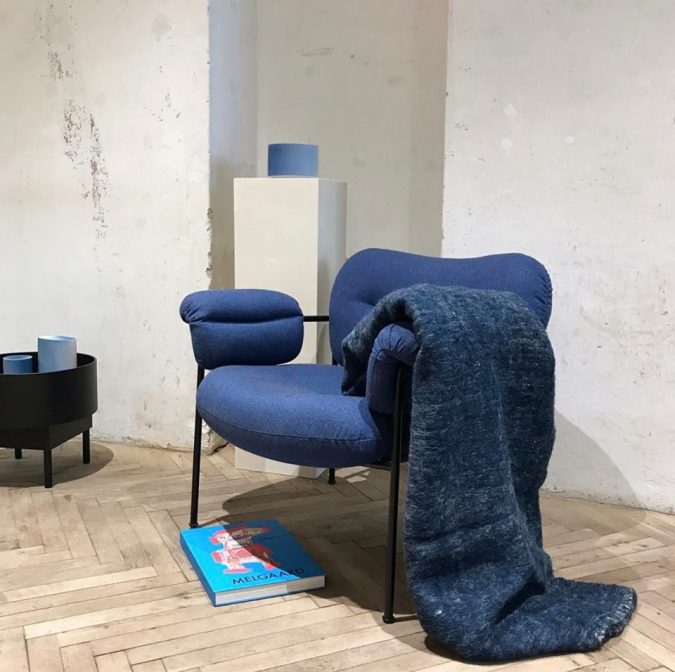
Where is `wall`? The width and height of the screenshot is (675, 672). wall is located at coordinates (171, 171), (545, 166).